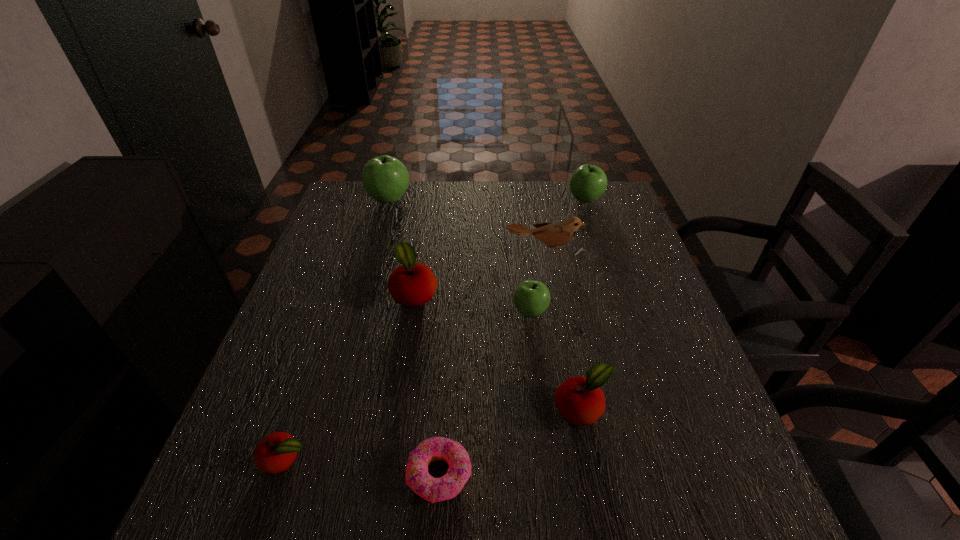
What are the coordinates of `the rightmost red apple` in the screenshot? It's located at (580, 401).

Where is `the nearest apple`? Image resolution: width=960 pixels, height=540 pixels. the nearest apple is located at coordinates (275, 453).

Find the location of a particular element. The width and height of the screenshot is (960, 540). the smallest red apple is located at coordinates (275, 453).

Find the location of `the shortest object`. the shortest object is located at coordinates (432, 489).

What are the coordinates of `doughnut` in the screenshot? It's located at pos(432,489).

At what (x,y) coordinates should I click in order to perform the action: click on vacant area situated on the front of the biggest green apple. Please return your answer as a coordinate pair (x, y). Image resolution: width=960 pixels, height=540 pixels. Looking at the image, I should click on (372, 259).

Find the location of a particular element. vacant space located on the left of the second tallest apple is located at coordinates (480, 200).

Image resolution: width=960 pixels, height=540 pixels. What are the coordinates of `vacant position located 0.170m at the beak of the sixth nearest object` in the screenshot? It's located at (554, 304).

Where is `vacant area situated 0.060m on the left of the second red apple from left to right`? vacant area situated 0.060m on the left of the second red apple from left to right is located at coordinates (367, 292).

At what (x,y) coordinates should I click in order to perform the action: click on vacant space located 0.220m on the left of the nearest green apple. Please return your answer as a coordinate pair (x, y). The height and width of the screenshot is (540, 960). Looking at the image, I should click on (420, 312).